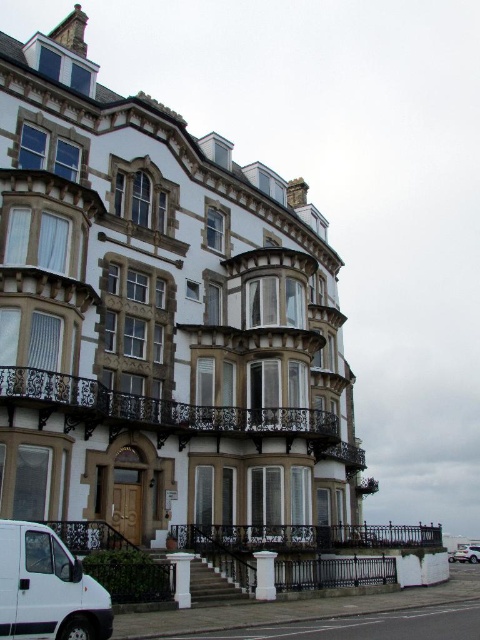
Can you confirm if dark brown wrought iron balcony at center is positioned to the left of white matte suv at lower right?

Indeed, dark brown wrought iron balcony at center is positioned on the left side of white matte suv at lower right.

Looking at this image, between dark brown wrought iron balcony at center and white matte suv at lower right, which one is positioned higher?

dark brown wrought iron balcony at center is higher up.

Between point (316, 412) and point (478, 557), which one is positioned behind?

Positioned behind is point (478, 557).

Identify the location of dark brown wrought iron balcony at center. Image resolution: width=480 pixels, height=640 pixels. (168, 413).

Can you confirm if dark brown wrought iron balcony at center is positioned above white matte van at lower left?

Yes.

Who is positioned more to the right, dark brown wrought iron balcony at center or white matte van at lower left?

From the viewer's perspective, dark brown wrought iron balcony at center appears more on the right side.

Who is more distant from viewer, (3, 372) or (101, 618)?

The point (3, 372) is behind.

Image resolution: width=480 pixels, height=640 pixels. What are the coordinates of `dark brown wrought iron balcony at center` in the screenshot? It's located at (168, 413).

Describe the element at coordinates (47, 588) in the screenshot. I see `white matte van at lower left` at that location.

Does white matte van at lower left appear on the right side of white matte suv at lower right?

In fact, white matte van at lower left is to the left of white matte suv at lower right.

Between point (37, 609) and point (469, 557), which one is positioned behind?

Positioned behind is point (469, 557).

Locate an element on the screen. Image resolution: width=480 pixels, height=640 pixels. white matte van at lower left is located at coordinates (47, 588).